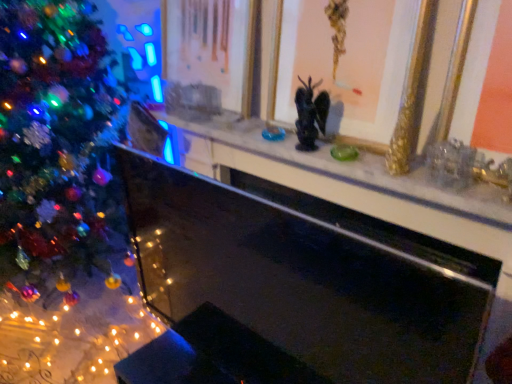
The width and height of the screenshot is (512, 384). What do you see at coordinates (294, 288) in the screenshot? I see `black glass fireplace at center` at bounding box center [294, 288].

What is the approximate width of gold/golden picture frame at upper center, the 1th picture frame in the right-to-left sequence?

4.16 inches.

In order to click on marble mantel at center in this screenshot , I will do `click(355, 170)`.

From the image's perspective, which is above, black glass fireplace at center or marble mantel at center?

marble mantel at center is shown above in the image.

Is black glass fireplace at center in front of or behind marble mantel at center in the image?

In the image, black glass fireplace at center appears in front of marble mantel at center.

Considering the sizes of objects black glass fireplace at center and marble mantel at center in the image provided, who is wider, black glass fireplace at center or marble mantel at center?

Wider between the two is marble mantel at center.

Is marble mantel at center outside of gold/golden picture frame at upper center, the 1th picture frame in the right-to-left sequence?

Yes, marble mantel at center is not within gold/golden picture frame at upper center, the 1th picture frame in the right-to-left sequence.

Looking at this image, measure the distance from marble mantel at center to gold/golden picture frame at upper center, the second picture frame viewed from the left.

The distance of marble mantel at center from gold/golden picture frame at upper center, the second picture frame viewed from the left, is 7.78 inches.

Considering the sizes of objects marble mantel at center and gold/golden picture frame at upper center, the second picture frame viewed from the left, in the image provided, who is taller, marble mantel at center or gold/golden picture frame at upper center, the second picture frame viewed from the left,?

With more height is gold/golden picture frame at upper center, the second picture frame viewed from the left.

The width and height of the screenshot is (512, 384). In order to click on picture frame that appears on the right of marble mantel at center in this screenshot , I will do `click(344, 64)`.

Which is behind, shiny multicolored ornaments at left or gold/golden picture frame at upper center, the 1th picture frame in the right-to-left sequence?

shiny multicolored ornaments at left.

Considering the positions of objects shiny multicolored ornaments at left and gold/golden picture frame at upper center, the second picture frame viewed from the left, in the image provided, who is more to the left, shiny multicolored ornaments at left or gold/golden picture frame at upper center, the second picture frame viewed from the left,?

shiny multicolored ornaments at left is more to the left.

Is shiny multicolored ornaments at left looking in the opposite direction of gold/golden picture frame at upper center, the 1th picture frame in the right-to-left sequence?

No.

From the image's perspective, relative to shiny multicolored ornaments at left, is gold/gilded picture frame at upper center, the second picture frame when ordered from right to left, above or below?

Clearly, from the image's perspective, gold/gilded picture frame at upper center, the second picture frame when ordered from right to left, is above shiny multicolored ornaments at left.

In terms of height, does gold/gilded picture frame at upper center, the second picture frame when ordered from right to left, look taller or shorter compared to shiny multicolored ornaments at left?

gold/gilded picture frame at upper center, the second picture frame when ordered from right to left, is shorter than shiny multicolored ornaments at left.

Considering the relative sizes of gold/gilded picture frame at upper center, the second picture frame when ordered from right to left, and shiny multicolored ornaments at left in the image provided, is gold/gilded picture frame at upper center, the second picture frame when ordered from right to left, bigger than shiny multicolored ornaments at left?

No.

How distant is gold/gilded picture frame at upper center, the second picture frame when ordered from right to left, from shiny multicolored ornaments at left?

gold/gilded picture frame at upper center, the second picture frame when ordered from right to left, is 25.45 inches away from shiny multicolored ornaments at left.

Does shiny multicolored ornaments at left appear on the right side of black glass fireplace at center?

In fact, shiny multicolored ornaments at left is to the left of black glass fireplace at center.

Considering the points (66, 46) and (389, 383), which point is behind, point (66, 46) or point (389, 383)?

The point (66, 46) is behind.

From the image's perspective, is shiny multicolored ornaments at left under black glass fireplace at center?

No, from the image's perspective, shiny multicolored ornaments at left is not below black glass fireplace at center.

Who is bigger, black glass fireplace at center or shiny multicolored ornaments at left?

Bigger between the two is shiny multicolored ornaments at left.

Between black glass fireplace at center and shiny multicolored ornaments at left, which one has smaller width?

black glass fireplace at center.

Can you tell me how much black glass fireplace at center and shiny multicolored ornaments at left differ in facing direction?

There is a 2.17-degree angle between the facing directions of black glass fireplace at center and shiny multicolored ornaments at left.

From a real-world perspective, is black glass fireplace at center positioned above or below shiny multicolored ornaments at left?

black glass fireplace at center is situated lower than shiny multicolored ornaments at left in the real world.

Does point (446, 213) appear closer or farther from the camera than point (252, 64)?

Point (446, 213) is positioned closer to the camera compared to point (252, 64).

From a real-world perspective, is marble mantel at center positioned over gold/gilded picture frame at upper center, the first picture frame when ordered from left to right, based on gravity?

Actually, marble mantel at center is physically below gold/gilded picture frame at upper center, the first picture frame when ordered from left to right, in the real world.

From the image's perspective, is marble mantel at center positioned above or below gold/gilded picture frame at upper center, the second picture frame when ordered from right to left?

Based on their image positions, marble mantel at center is located beneath gold/gilded picture frame at upper center, the second picture frame when ordered from right to left.

Is marble mantel at center looking in the opposite direction of gold/gilded picture frame at upper center, the first picture frame when ordered from left to right?

No, marble mantel at center is not facing the opposite direction of gold/gilded picture frame at upper center, the first picture frame when ordered from left to right.

The height and width of the screenshot is (384, 512). What are the coordinates of `mantle lying behind the black glass fireplace at center` in the screenshot? It's located at (355, 170).

What are the coordinates of `the 1st picture frame above the marble mantel at center (from the image's perspective)` in the screenshot? It's located at (344, 64).

When comparing their distances from gold/golden picture frame at upper center, the second picture frame viewed from the left, does shiny multicolored ornaments at left or marble mantel at center seem closer?

marble mantel at center is positioned closer to the anchor gold/golden picture frame at upper center, the second picture frame viewed from the left.

Based on their spatial positions, is gold/golden picture frame at upper center, the 1th picture frame in the right-to-left sequence, or black glass fireplace at center closer to gold/gilded picture frame at upper center, the first picture frame when ordered from left to right?

Based on the image, gold/golden picture frame at upper center, the 1th picture frame in the right-to-left sequence, appears to be nearer to gold/gilded picture frame at upper center, the first picture frame when ordered from left to right.

Estimate the real-world distances between objects in this image. Which object is further from shiny multicolored ornaments at left, gold/gilded picture frame at upper center, the second picture frame when ordered from right to left, or gold/golden picture frame at upper center, the 1th picture frame in the right-to-left sequence?

gold/golden picture frame at upper center, the 1th picture frame in the right-to-left sequence, is further to shiny multicolored ornaments at left.

When comparing their distances from gold/golden picture frame at upper center, the 1th picture frame in the right-to-left sequence, does black glass fireplace at center or shiny multicolored ornaments at left seem closer?

Among the two, black glass fireplace at center is located nearer to gold/golden picture frame at upper center, the 1th picture frame in the right-to-left sequence.

When comparing their distances from black glass fireplace at center, does gold/golden picture frame at upper center, the second picture frame viewed from the left, or gold/gilded picture frame at upper center, the first picture frame when ordered from left to right, seem further?

gold/gilded picture frame at upper center, the first picture frame when ordered from left to right, is further to black glass fireplace at center.

Which object lies nearer to the anchor point gold/golden picture frame at upper center, the second picture frame viewed from the left, marble mantel at center or shiny multicolored ornaments at left?

marble mantel at center is positioned closer to the anchor gold/golden picture frame at upper center, the second picture frame viewed from the left.

Estimate the real-world distances between objects in this image. Which object is further from marble mantel at center, gold/gilded picture frame at upper center, the first picture frame when ordered from left to right, or gold/golden picture frame at upper center, the second picture frame viewed from the left?

Among the two, gold/gilded picture frame at upper center, the first picture frame when ordered from left to right, is located further to marble mantel at center.

From the image, which object appears to be nearer to black glass fireplace at center, gold/gilded picture frame at upper center, the second picture frame when ordered from right to left, or gold/golden picture frame at upper center, the second picture frame viewed from the left?

gold/golden picture frame at upper center, the second picture frame viewed from the left, is positioned closer to the anchor black glass fireplace at center.

The width and height of the screenshot is (512, 384). In order to click on picture frame between shiny multicolored ornaments at left and gold/golden picture frame at upper center, the second picture frame viewed from the left, in the horizontal direction in this screenshot , I will do `click(209, 57)`.

Where is `picture frame between gold/gilded picture frame at upper center, the second picture frame when ordered from right to left, and black glass fireplace at center in the up-down direction`? The height and width of the screenshot is (384, 512). picture frame between gold/gilded picture frame at upper center, the second picture frame when ordered from right to left, and black glass fireplace at center in the up-down direction is located at coordinates (344, 64).

In order to click on picture frame located between shiny multicolored ornaments at left and marble mantel at center in the left-right direction in this screenshot , I will do `click(209, 57)`.

Image resolution: width=512 pixels, height=384 pixels. In order to click on fireplace between shiny multicolored ornaments at left and marble mantel at center from left to right in this screenshot , I will do `click(294, 288)`.